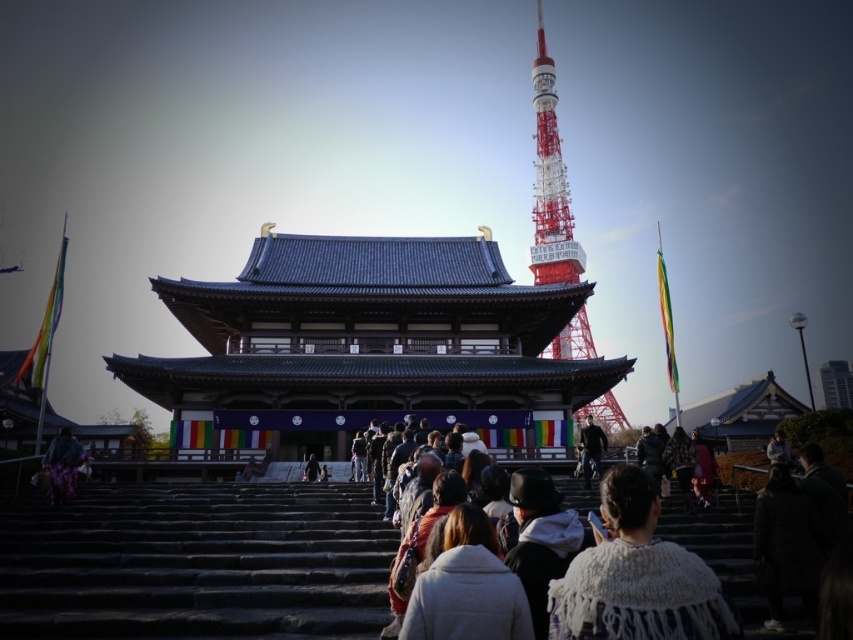
Who is shorter, shiny blue pagoda at center or dark stone stairs at center?

Standing shorter between the two is dark stone stairs at center.

Is shiny blue pagoda at center thinner than dark stone stairs at center?

No, shiny blue pagoda at center is not thinner than dark stone stairs at center.

Where is `shiny blue pagoda at center`? Image resolution: width=853 pixels, height=640 pixels. shiny blue pagoda at center is located at coordinates (367, 348).

Locate an element on the screen. shiny blue pagoda at center is located at coordinates [x=367, y=348].

Between point (345, 588) and point (538, 3), which one is positioned behind?

Positioned behind is point (538, 3).

Is dark stone stairs at center in front of red and white painted metal tower at upper center?

Yes, it is in front of red and white painted metal tower at upper center.

The image size is (853, 640). Describe the element at coordinates (196, 563) in the screenshot. I see `dark stone stairs at center` at that location.

The width and height of the screenshot is (853, 640). What are the coordinates of `dark stone stairs at center` in the screenshot? It's located at 196,563.

Does shiny blue pagoda at center appear on the right side of white fuzzy jacket at center?

Yes, shiny blue pagoda at center is to the right of white fuzzy jacket at center.

Is shiny blue pagoda at center further to camera compared to white fuzzy jacket at center?

Yes, it is.

Find the location of a particular element. Image resolution: width=853 pixels, height=640 pixels. shiny blue pagoda at center is located at coordinates (367, 348).